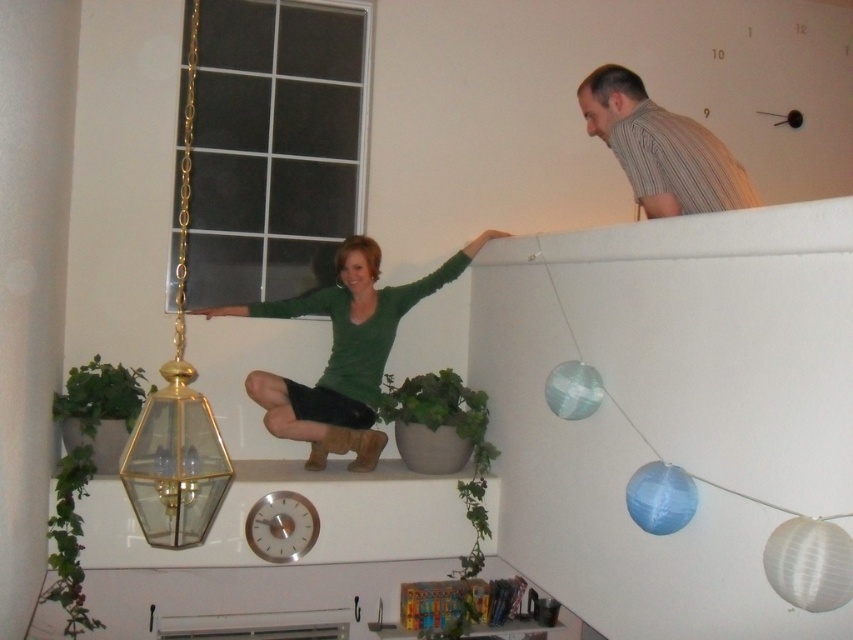
You are organizing a clothing donation drive and need to determine which of the two garments, the green matte sweater at upper center or the striped cotton shirt at upper right, can fit into a standard donation box that accommodates items up to the size of the larger garment. Which garment should you choose?

The green matte sweater at upper center has a larger size compared to the striped cotton shirt at upper right, so you should choose the green matte sweater at upper center as it is the larger garment and the donation box can accommodate items up to its size.

You are an interior designer assessing the space between the green matte sweater at upper center and the gold glass pendant light at upper left. Which object takes up more space in the scene?

The green matte sweater at upper center is bigger than the gold glass pendant light at upper left, so it takes up more space in the scene.